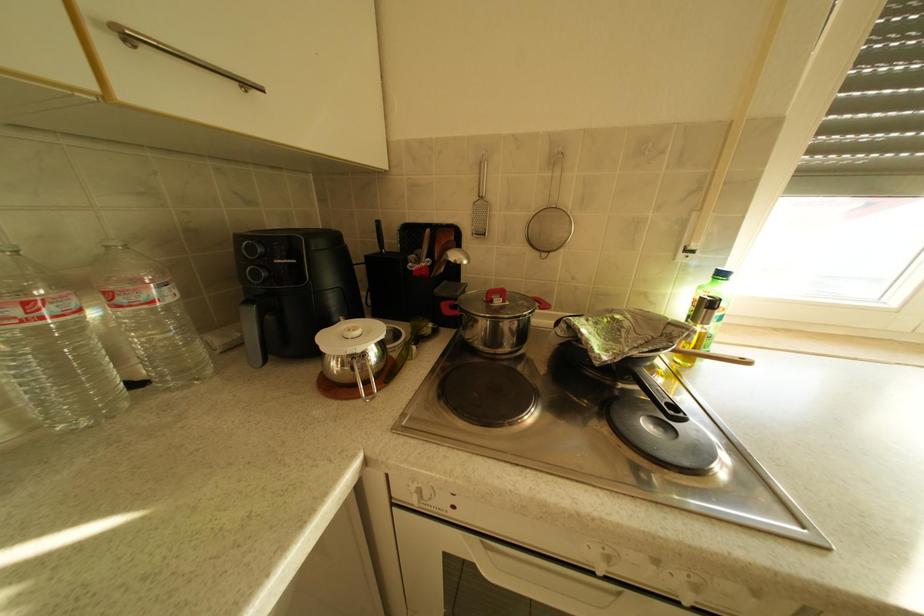
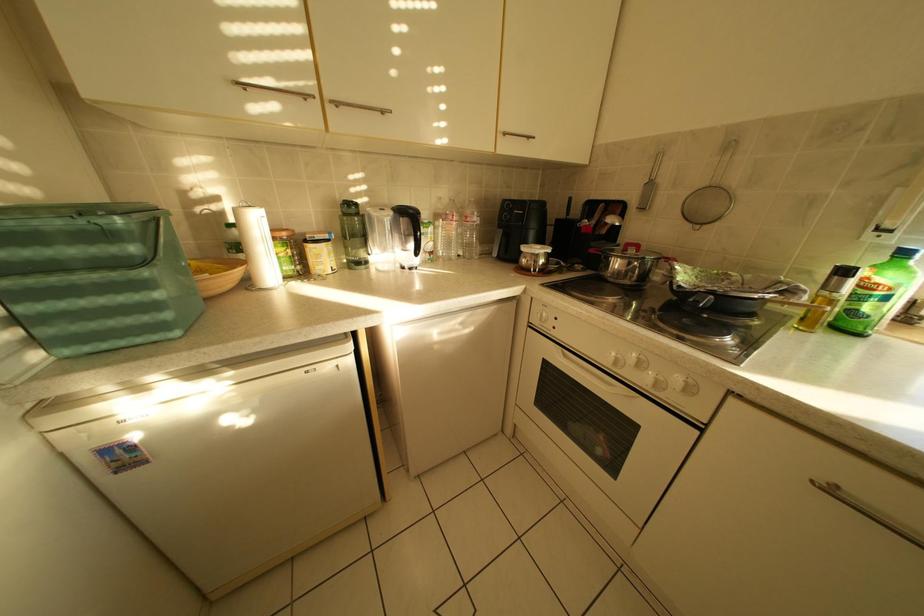
Question: Based on the continuous images, in which direction is the camera rotating? Reply with the corresponding letter.

Choices:
 (A) Left
 (B) Right
 (C) Up
 (D) Down

Answer: (A)